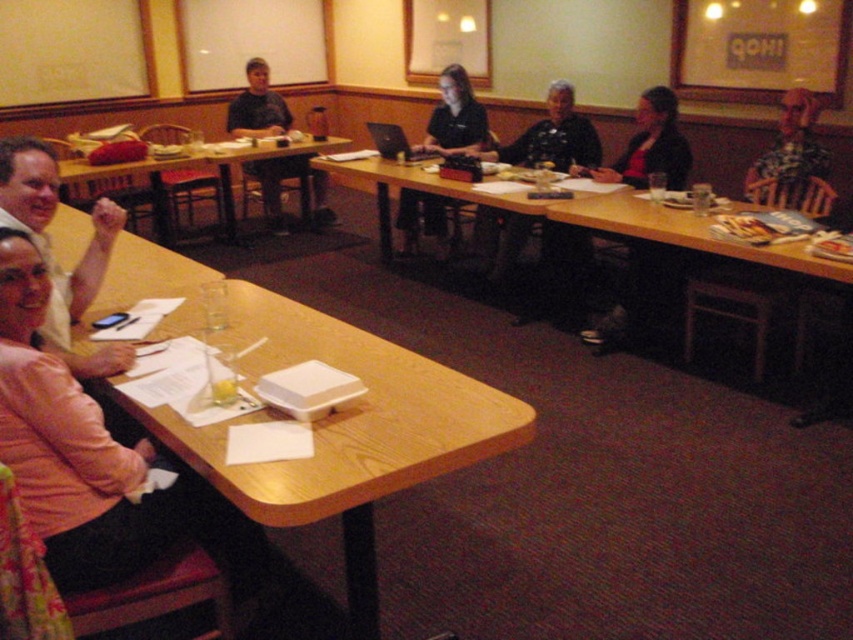
You are organizing a small workshop and need to seat 8 people comfortably. The wooden table at lower right and the checkered shirt at upper right are part of the setup. Considering their sizes, which object can accommodate more people around it?

The wooden table at lower right can accommodate more people because its width is larger than the checkered shirt at upper right.